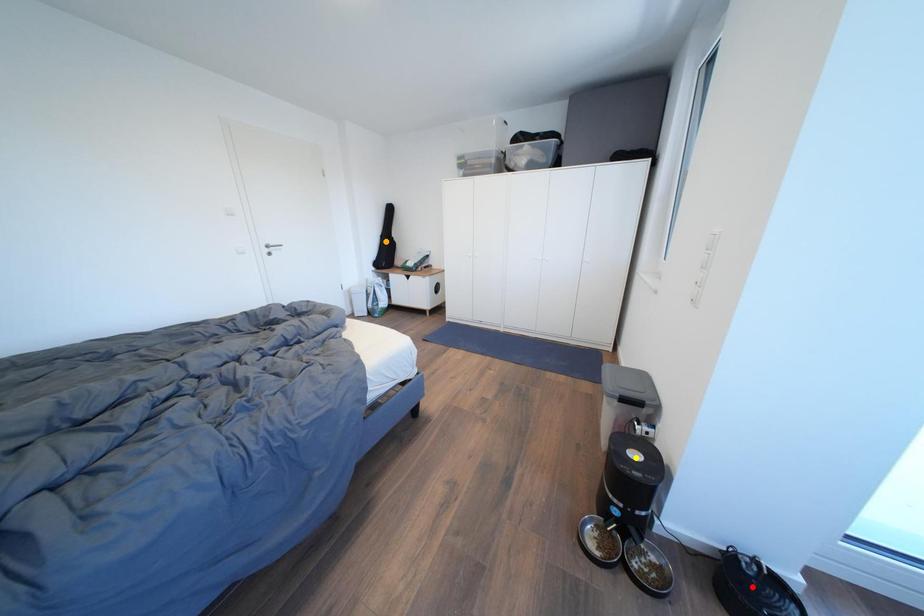
Order these from farthest to nearest:
red point
orange point
yellow point

orange point
yellow point
red point